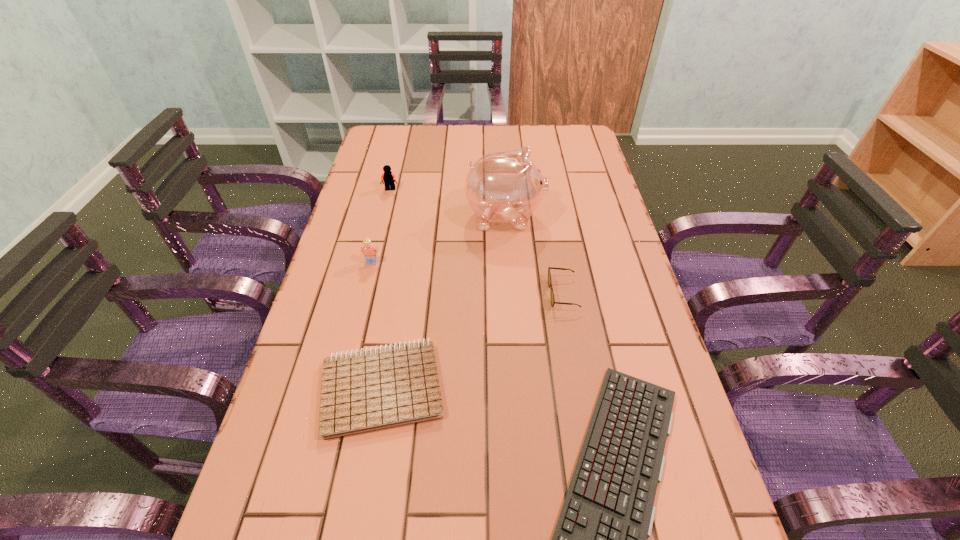
Locate an element on the screen. The height and width of the screenshot is (540, 960). vacant space located on the front-facing side of the sunglasses is located at coordinates (457, 294).

Identify the location of vacant space located on the front-facing side of the sunglasses. This screenshot has height=540, width=960. (392, 294).

Where is `free space located on the front-facing side of the sunglasses`? free space located on the front-facing side of the sunglasses is located at coordinates (461, 294).

At what (x,y) coordinates should I click in order to perform the action: click on vacant space located on the right of the second shortest object. Please return your answer as a coordinate pair (x, y). This screenshot has height=540, width=960. Looking at the image, I should click on pos(528,387).

Locate an element on the screen. notebook that is at the left edge is located at coordinates (364, 391).

Find the location of a particular element. object located in the right edge section of the desktop is located at coordinates (553, 302).

Where is `vacant space at the far edge`? vacant space at the far edge is located at coordinates (547, 155).

The height and width of the screenshot is (540, 960). What are the coordinates of `vacant space at the left edge of the desktop` in the screenshot? It's located at (283, 443).

The width and height of the screenshot is (960, 540). In order to click on free space at the right edge in this screenshot , I will do `click(627, 288)`.

Image resolution: width=960 pixels, height=540 pixels. I want to click on free space at the far right corner of the desktop, so pos(567,153).